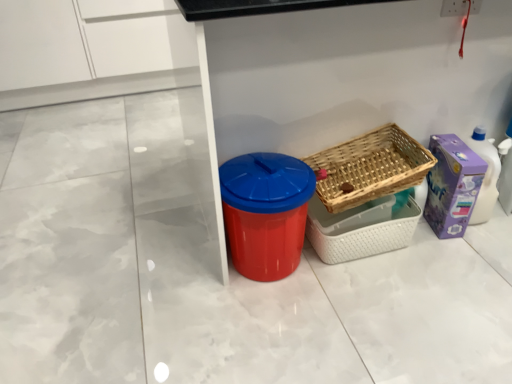
Question: From the image's perspective, is woven wood basket at center right, marked as the second basket in a top-to-bottom arrangement, over red plastic bin at center?

Choices:
 (A) yes
 (B) no

Answer: (B)

Question: From a real-world perspective, does woven wood basket at center right, marked as the second basket in a top-to-bottom arrangement, sit lower than red plastic bin at center?

Choices:
 (A) yes
 (B) no

Answer: (A)

Question: Does woven wood basket at center right, marked as the second basket in a top-to-bottom arrangement, have a smaller size compared to red plastic bin at center?

Choices:
 (A) no
 (B) yes

Answer: (B)

Question: Can you confirm if woven wood basket at center right, which appears as the first basket when ordered from the bottom, is wider than red plastic bin at center?

Choices:
 (A) yes
 (B) no

Answer: (B)

Question: From a real-world perspective, is woven wood basket at center right, which appears as the first basket when ordered from the bottom, on red plastic bin at center?

Choices:
 (A) no
 (B) yes

Answer: (A)

Question: Is red plastic bin at center wider or thinner than woven wood basket at center right, which appears as the 2th basket when ordered from the bottom?

Choices:
 (A) thin
 (B) wide

Answer: (B)

Question: From a real-world perspective, relative to woven wood basket at center right, the first basket in the top-to-bottom sequence, is red plastic bin at center vertically above or below?

Choices:
 (A) below
 (B) above

Answer: (A)

Question: From the image's perspective, is red plastic bin at center located above or below woven wood basket at center right, the first basket in the top-to-bottom sequence?

Choices:
 (A) above
 (B) below

Answer: (B)

Question: Is red plastic bin at center bigger or smaller than woven wood basket at center right, the first basket in the top-to-bottom sequence?

Choices:
 (A) big
 (B) small

Answer: (A)

Question: In terms of width, does woven wood basket at center right, which appears as the first basket when ordered from the bottom, look wider or thinner when compared to red plastic bin at center?

Choices:
 (A) thin
 (B) wide

Answer: (A)

Question: From a real-world perspective, is woven wood basket at center right, which appears as the first basket when ordered from the bottom, physically located above or below red plastic bin at center?

Choices:
 (A) below
 (B) above

Answer: (A)

Question: Considering the positions of woven wood basket at center right, marked as the second basket in a top-to-bottom arrangement, and red plastic bin at center in the image, is woven wood basket at center right, marked as the second basket in a top-to-bottom arrangement, taller or shorter than red plastic bin at center?

Choices:
 (A) short
 (B) tall

Answer: (A)

Question: From the image's perspective, relative to red plastic bin at center, is woven wood basket at center right, marked as the second basket in a top-to-bottom arrangement, above or below?

Choices:
 (A) below
 (B) above

Answer: (A)

Question: Based on their positions, is purple cardboard box at right located to the left or right of woven wood basket at center right, which appears as the first basket when ordered from the bottom?

Choices:
 (A) right
 (B) left

Answer: (A)

Question: Considering the positions of purple cardboard box at right and woven wood basket at center right, which appears as the first basket when ordered from the bottom, in the image, is purple cardboard box at right bigger or smaller than woven wood basket at center right, which appears as the first basket when ordered from the bottom,?

Choices:
 (A) big
 (B) small

Answer: (B)